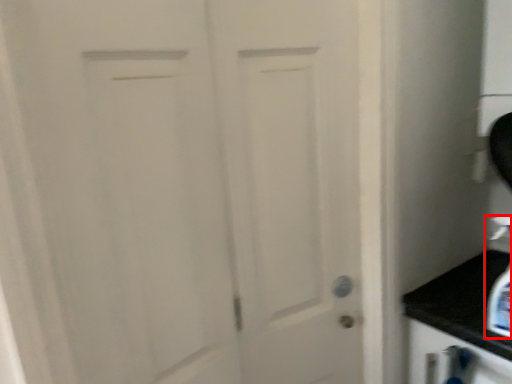
Question: From the image's perspective, what is the correct spatial relationship of soap dispenser (annotated by the red box) in relation to door?

Choices:
 (A) below
 (B) above

Answer: (A)